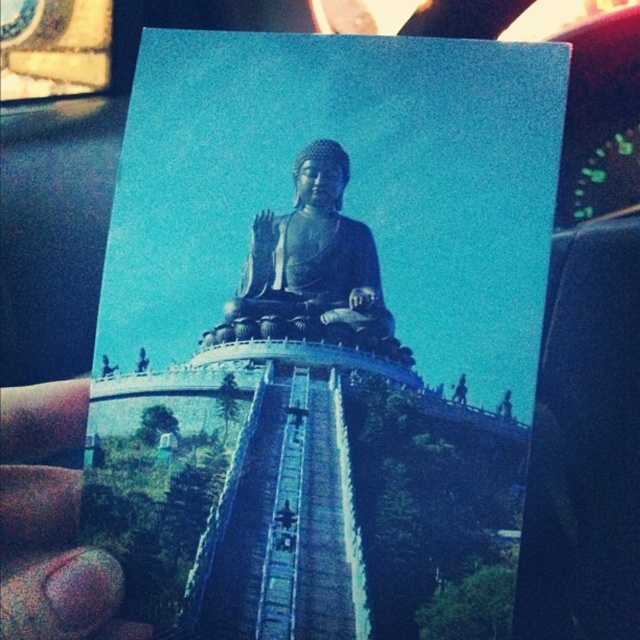
You are standing at the base of the hill where the metallic statue at center is located. You want to take a photo of the statue without any obstructions. Since you are 6.40 meters away from the statue, will you be able to capture the entire statue in your photo if your camera has a standard 50mm lens?

The metallic statue at center is 6.40 meters away from the camera. With a standard 50mm lens, capturing the entire statue would depend on the statue size and camera sensor size. However, since the statue is 6.40 meters away, it might be possible to frame it fully, but this requires knowing the statue height and camera specifications.

You are an art conservator examining the image of the Buddha statue. You notice the pink nail polish at lower left and the black polished statue at center. Which object is located below the other?

The pink nail polish at lower left is positioned under the black polished statue at center.